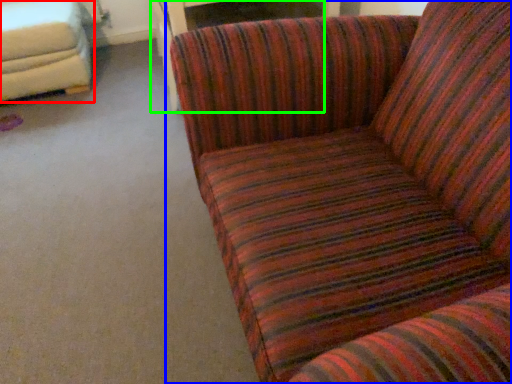
Question: Which object is the farthest from studio couch (highlighted by a red box)? Choose among these: studio couch (highlighted by a blue box) or table (highlighted by a green box).

Choices:
 (A) studio couch
 (B) table

Answer: (A)